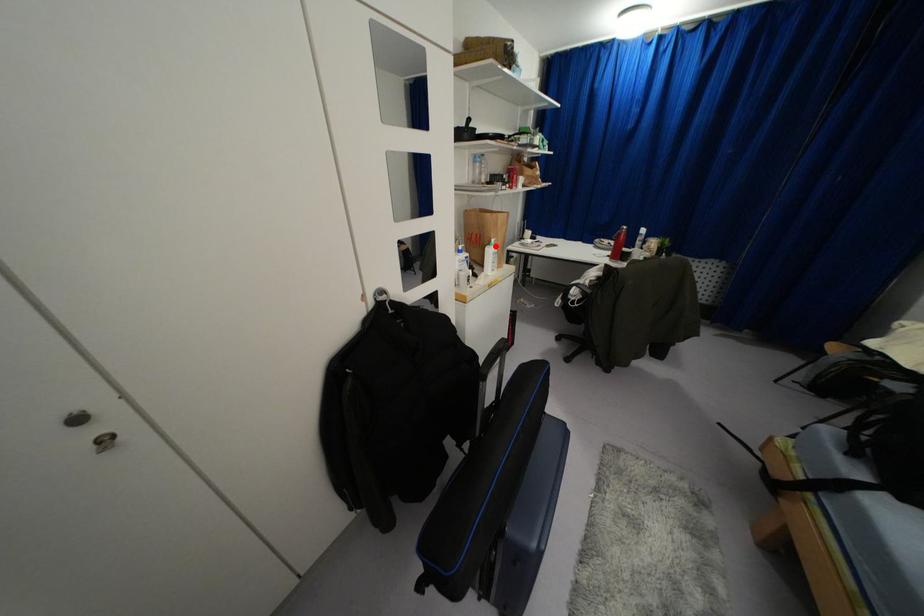
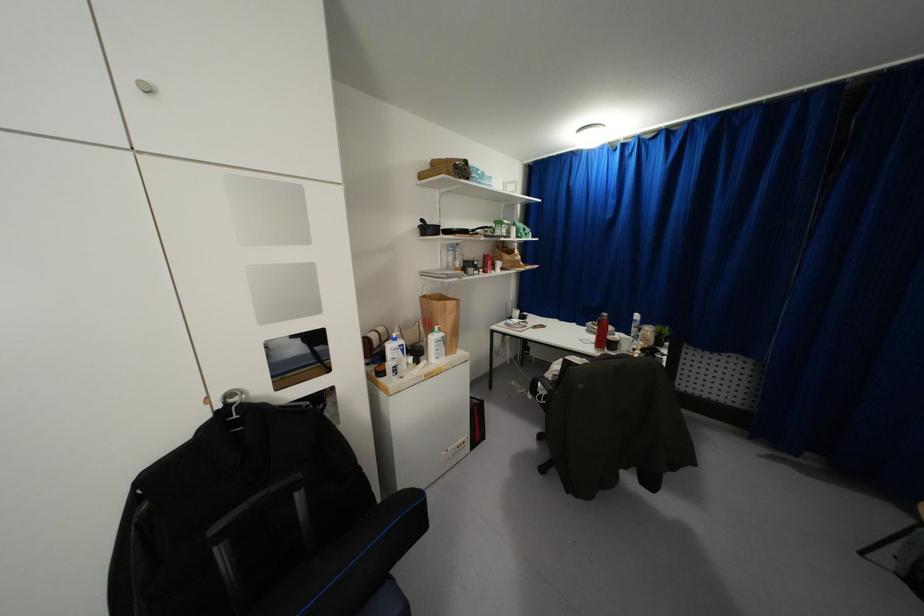
Where in the second image is the point corresponding to the highlighted location from the first image?

(442, 333)